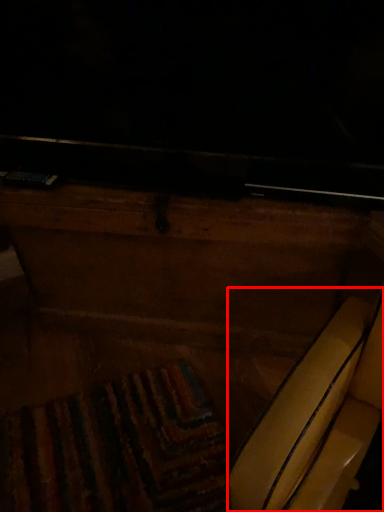
Question: Considering the relative positions of swivel chair (annotated by the red box) and furniture in the image provided, where is swivel chair (annotated by the red box) located with respect to the staircase?

Choices:
 (A) right
 (B) left

Answer: (A)